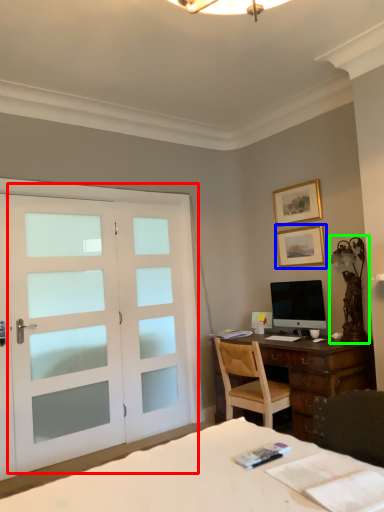
Question: Considering the real-world distances, which object is farthest from door (highlighted by a red box)? picture frame (highlighted by a blue box) or table lamp (highlighted by a green box)?

Choices:
 (A) picture frame
 (B) table lamp

Answer: (B)